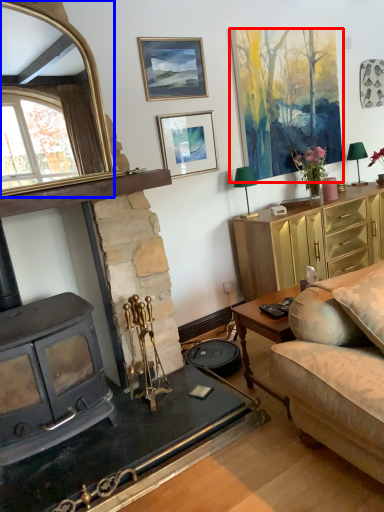
Question: Which of the following is the farthest to the observer, picture frame (highlighted by a red box) or mirror (highlighted by a blue box)?

Choices:
 (A) picture frame
 (B) mirror

Answer: (A)